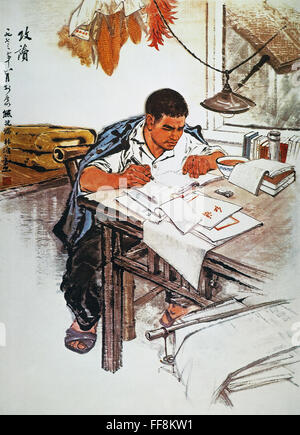
Where is `pendant lamp`? This screenshot has width=300, height=435. pendant lamp is located at coordinates (226, 97).